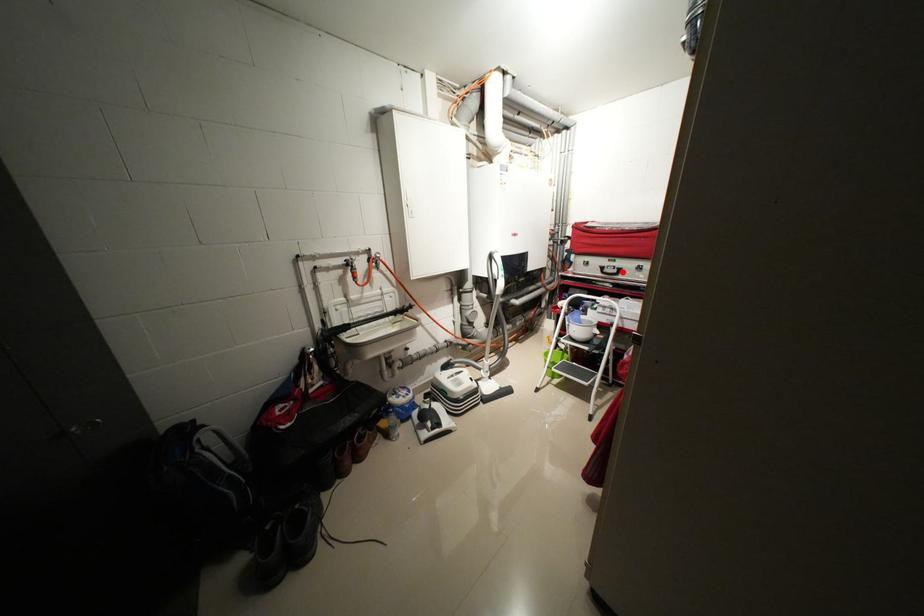
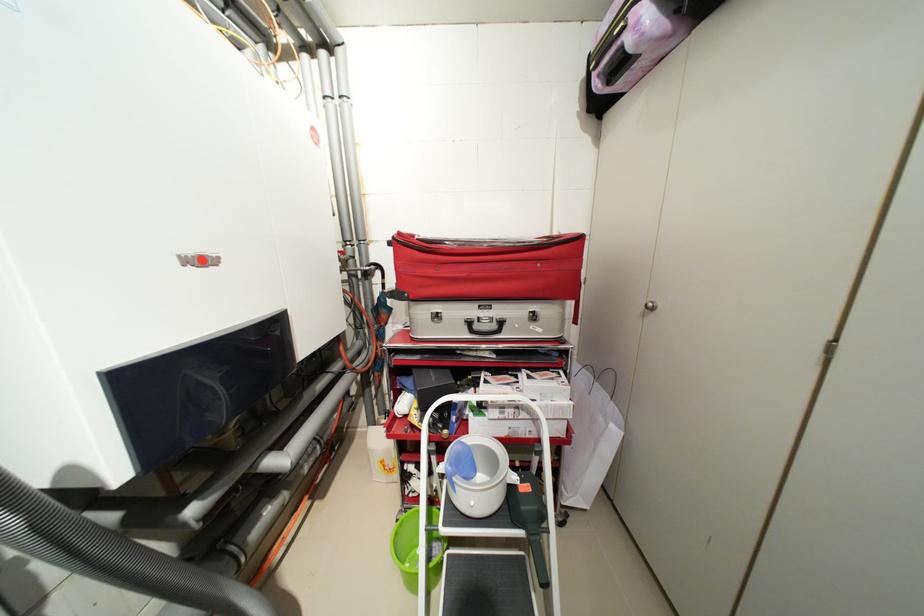
Question: I am providing you with two images of the same scene from different viewpoints. Image1 has a red point marked. In image2, the corresponding 3D location appears at what relative position? Reply with the corresponding letter.

Choices:
 (A) Closer
 (B) Farther

Answer: (B)